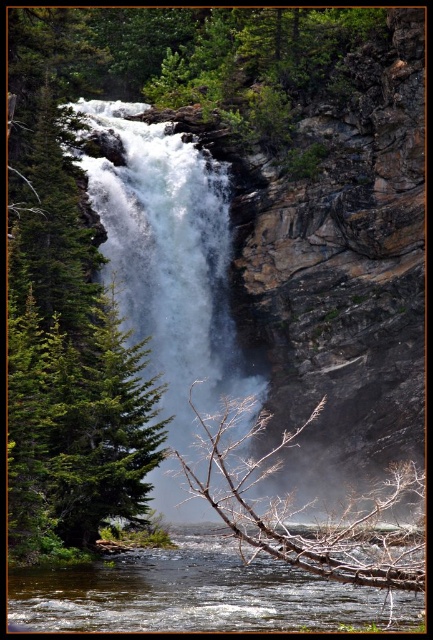
Question: Which of the following is the farthest from the observer?

Choices:
 (A) clear water at center
 (B) white frothy water at center

Answer: (B)

Question: Which point appears farthest from the camera in this image?

Choices:
 (A) (122, 118)
 (B) (377, 600)

Answer: (A)

Question: Observing the image, what is the correct spatial positioning of white frothy water at center in reference to clear water at center?

Choices:
 (A) above
 (B) below

Answer: (A)

Question: Is white frothy water at center positioned at the back of clear water at center?

Choices:
 (A) no
 (B) yes

Answer: (B)

Question: Is white frothy water at center closer to camera compared to clear water at center?

Choices:
 (A) yes
 (B) no

Answer: (B)